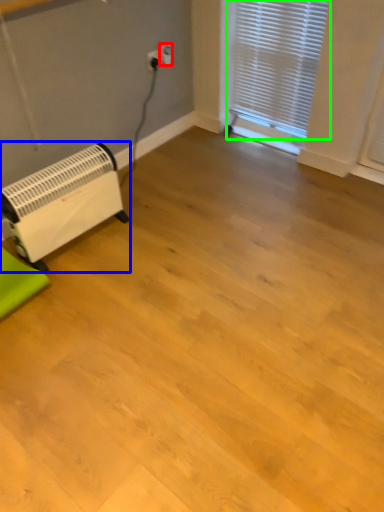
Question: Which object is positioned closest to electric outlet (highlighted by a red box)? Select from appliance (highlighted by a blue box) and window blind (highlighted by a green box).

Choices:
 (A) appliance
 (B) window blind

Answer: (B)